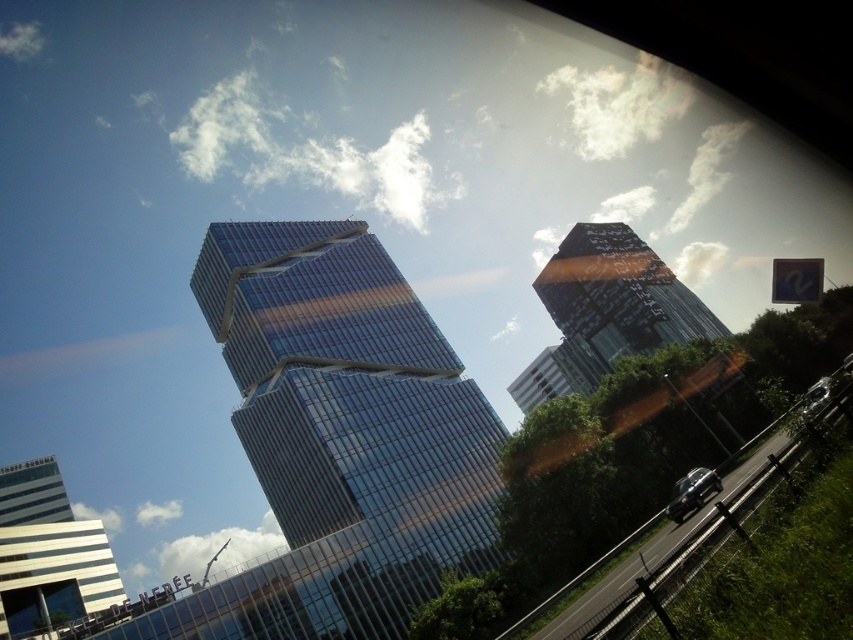
Question: In this image, where is glassy reflective building at center located relative to shiny black sedan at lower right?

Choices:
 (A) above
 (B) below

Answer: (A)

Question: Is the position of black asphalt highway at lower right less distant than that of white glossy building at lower left?

Choices:
 (A) no
 (B) yes

Answer: (B)

Question: Which is farther from the white glossy building at lower left?

Choices:
 (A) glassy reflective building at center
 (B) shiny black sedan at lower right

Answer: (A)

Question: Which object appears closest to the camera in this image?

Choices:
 (A) shiny black sedan at lower right
 (B) white glossy building at lower left

Answer: (A)

Question: Estimate the real-world distances between objects in this image. Which object is closer to the white glossy building at lower left?

Choices:
 (A) black asphalt highway at lower right
 (B) shiny black sedan at lower right
 (C) glassy reflective building at center
 (D) glassy metallic skyscraper at center

Answer: (D)

Question: Where is black asphalt highway at lower right located in relation to white glossy building at lower left in the image?

Choices:
 (A) below
 (B) above

Answer: (B)